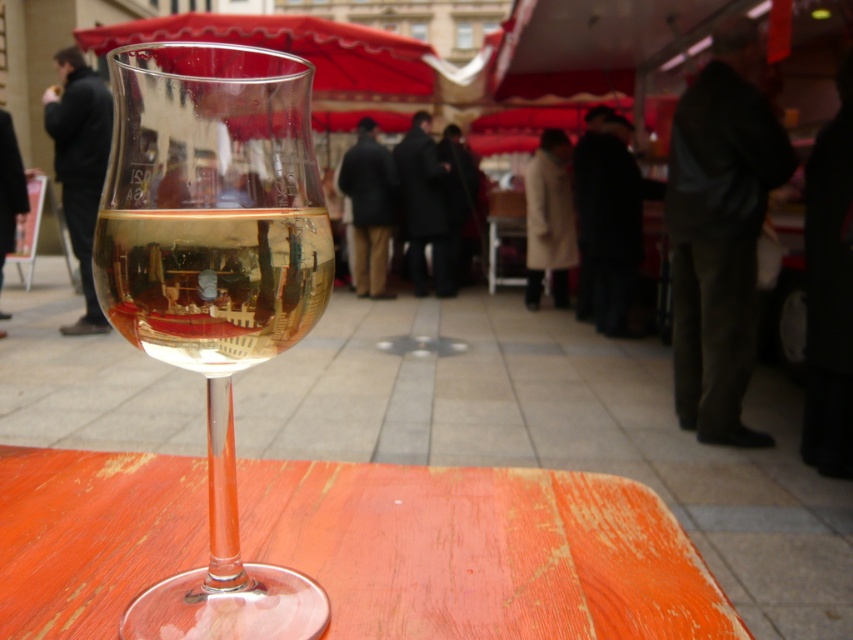
You are standing at the center of the outdoor market scene. There is a clear glass wine at center represented by point (213,282). If you want to take a photo of the wine glass without including the people under the red canopies in the background, where should you position yourself relative to the wine glass?

Result: To avoid including the people under the red canopies in the background, you should position yourself closer to the clear glass wine at center represented by point (213,282) so that the foreground object blocks the background.

You are at an outdoor market and want to place a small plate on the wooden table at center. However, there is already a clear glass wine at center on the table. Where should you place the plate so it doesn not fall off the table?

Since the wooden table at center is to the left of the clear glass wine at center, you should place the plate to the right side of the clear glass wine at center to ensure it stays on the table.